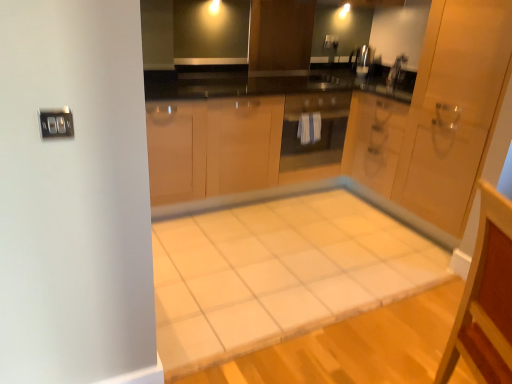
Question: Looking at the image, does matte glass oven at center seem bigger or smaller compared to white tile vanity at lower right?

Choices:
 (A) small
 (B) big

Answer: (A)

Question: Is point (300, 96) closer or farther from the camera than point (478, 375)?

Choices:
 (A) farther
 (B) closer

Answer: (A)

Question: Which of these objects is positioned closest to the white tile vanity at lower right?

Choices:
 (A) satin nickel faucet at upper center
 (B) white tile table at center
 (C) wooden door at right
 (D) matte glass oven at center

Answer: (B)

Question: Which object is the closest to the satin nickel faucet at upper center?

Choices:
 (A) white tile vanity at lower right
 (B) wooden door at right
 (C) white tile table at center
 (D) matte glass oven at center

Answer: (D)